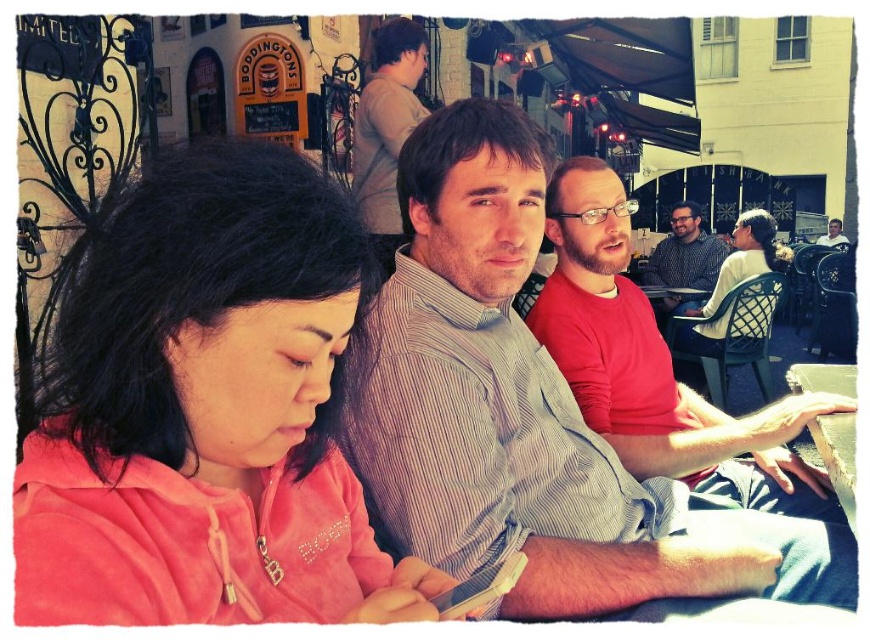
Question: Does red cotton shirt at center have a lesser width compared to patterned shirt at center?

Choices:
 (A) yes
 (B) no

Answer: (B)

Question: Which point is closer to the camera taking this photo?

Choices:
 (A) (349, 337)
 (B) (828, 572)

Answer: (A)

Question: Which of the following is the closest to the observer?

Choices:
 (A) red cotton shirt at center
 (B) patterned shirt at center

Answer: (A)

Question: Does striped cotton shirt at center appear over smooth skin face at upper right?

Choices:
 (A) no
 (B) yes

Answer: (A)

Question: Is pink fleece jacket at center thinner than striped cotton shirt at center?

Choices:
 (A) no
 (B) yes

Answer: (B)

Question: Which point is farther to the camera?

Choices:
 (A) smooth skin face at upper right
 (B) red cotton shirt at center

Answer: (A)